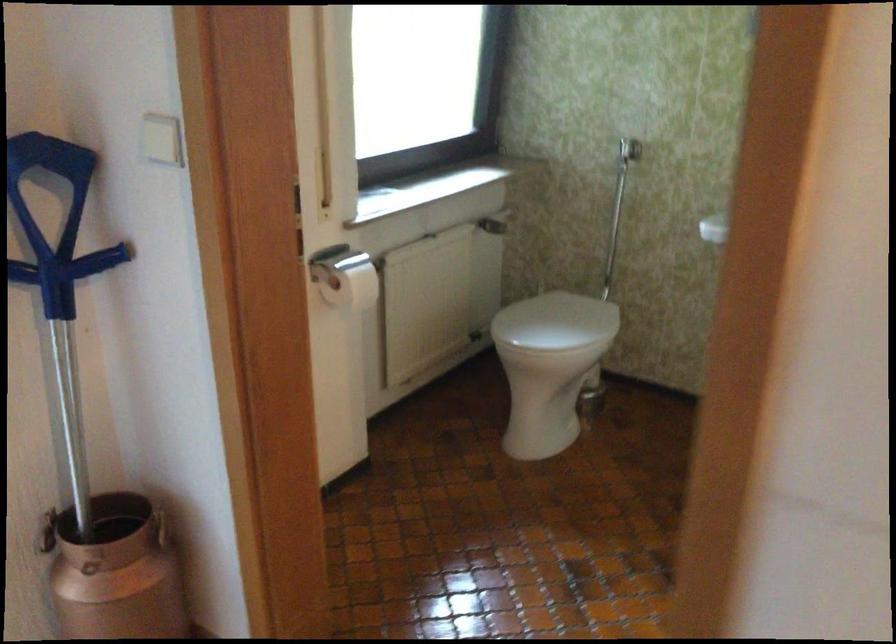
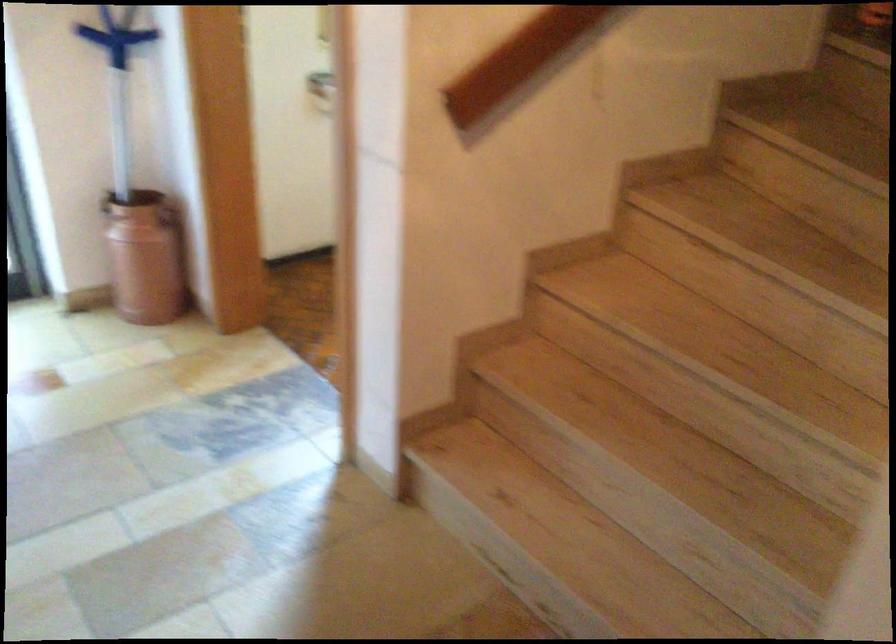
Find the pixel in the second image that matches [167,536] in the first image.

(168, 216)